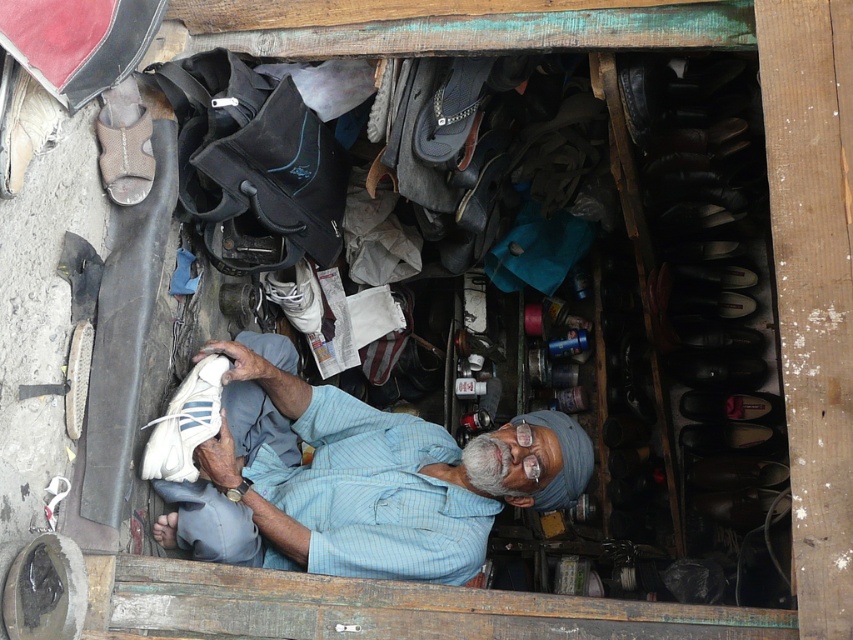
Question: Which object is closer to the camera taking this photo?

Choices:
 (A) white fabric shoe at center
 (B) white fabric shoe at lower left

Answer: (A)

Question: Does white fabric shoe at center lie in front of white fabric shoe at lower left?

Choices:
 (A) yes
 (B) no

Answer: (A)

Question: Which point is closer to the camera?

Choices:
 (A) (190, 474)
 (B) (514, 483)

Answer: (A)

Question: Is white fabric shoe at center in front of white fabric shoe at lower left?

Choices:
 (A) yes
 (B) no

Answer: (A)

Question: Can you confirm if white fabric shoe at center is positioned below white fabric shoe at lower left?

Choices:
 (A) no
 (B) yes

Answer: (B)